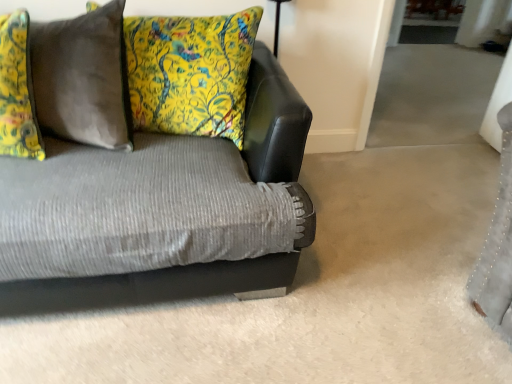
Question: From the image's perspective, is textured gray couch at center located above velvet gray pillow at upper left, the 2th pillow from the right?

Choices:
 (A) yes
 (B) no

Answer: (B)

Question: Is textured gray couch at center turned away from velvet gray pillow at upper left, the 2th pillow positioned from the left?

Choices:
 (A) yes
 (B) no

Answer: (A)

Question: From a real-world perspective, is textured gray couch at center positioned under velvet gray pillow at upper left, the 2th pillow positioned from the left, based on gravity?

Choices:
 (A) no
 (B) yes

Answer: (B)

Question: Is textured gray couch at center located outside velvet gray pillow at upper left, the 2th pillow positioned from the left?

Choices:
 (A) no
 (B) yes

Answer: (B)

Question: Is textured gray couch at center bigger than velvet gray pillow at upper left, the 2th pillow from the right?

Choices:
 (A) no
 (B) yes

Answer: (B)

Question: Is point (48, 34) closer or farther from the camera than point (25, 152)?

Choices:
 (A) farther
 (B) closer

Answer: (A)

Question: Would you say velvet gray pillow at upper left, the 2th pillow from the right, is to the left or to the right of floral fabric pillow at left, which is the first pillow in left-to-right order, in the picture?

Choices:
 (A) left
 (B) right

Answer: (B)

Question: Considering the positions of velvet gray pillow at upper left, the 2th pillow from the right, and floral fabric pillow at left, the 3th pillow from the right, in the image, is velvet gray pillow at upper left, the 2th pillow from the right, taller or shorter than floral fabric pillow at left, the 3th pillow from the right,?

Choices:
 (A) tall
 (B) short

Answer: (A)

Question: Considering the positions of velvet gray pillow at upper left, the 2th pillow from the right, and floral fabric pillow at left, which is the first pillow in left-to-right order, in the image, is velvet gray pillow at upper left, the 2th pillow from the right, bigger or smaller than floral fabric pillow at left, which is the first pillow in left-to-right order,?

Choices:
 (A) big
 (B) small

Answer: (A)

Question: Looking at the image, does velvet gray pillow at upper left, the 2th pillow from the right, seem bigger or smaller compared to yellow floral cushion at upper left, the 1th pillow positioned from the right?

Choices:
 (A) small
 (B) big

Answer: (A)

Question: Would you say velvet gray pillow at upper left, the 2th pillow positioned from the left, is inside or outside yellow floral cushion at upper left, the 1th pillow positioned from the right?

Choices:
 (A) outside
 (B) inside

Answer: (A)

Question: Is velvet gray pillow at upper left, the 2th pillow from the right, taller or shorter than yellow floral cushion at upper left, the 1th pillow positioned from the right?

Choices:
 (A) short
 (B) tall

Answer: (A)

Question: Would you say velvet gray pillow at upper left, the 2th pillow from the right, is to the left or to the right of yellow floral cushion at upper left, the third pillow viewed from the left, in the picture?

Choices:
 (A) right
 (B) left

Answer: (B)

Question: From a real-world perspective, relative to textured gray couch at center, is velvet gray pillow at upper left, the 2th pillow from the right, vertically above or below?

Choices:
 (A) below
 (B) above

Answer: (B)

Question: Do you think velvet gray pillow at upper left, the 2th pillow from the right, is within textured gray couch at center, or outside of it?

Choices:
 (A) inside
 (B) outside

Answer: (A)